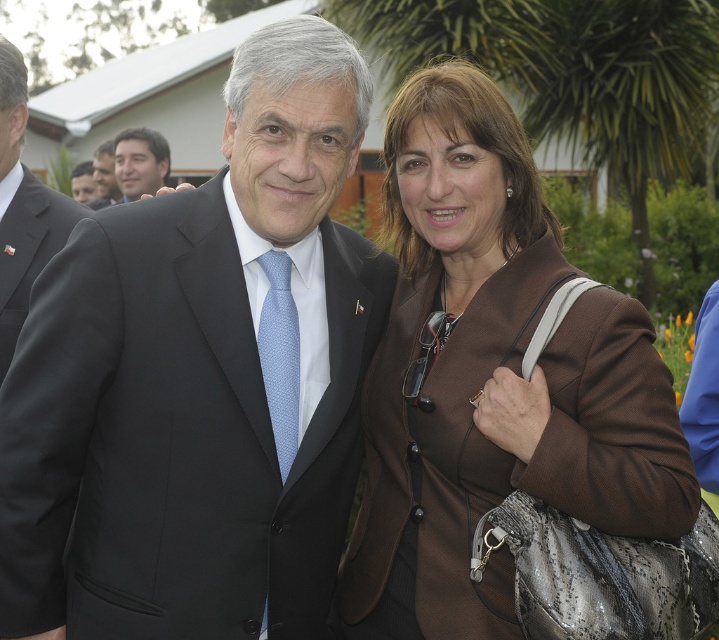
Question: Does light blue textured tie at center lie in front of matte black suit at upper left?

Choices:
 (A) yes
 (B) no

Answer: (A)

Question: Based on their relative distances, which object is nearer to the black suit at left?

Choices:
 (A) light blue textured tie at center
 (B) matte black suit at upper left
 (C) black smooth suit at center
 (D) matte black suit at center

Answer: (C)

Question: Does brown textured jacket at center come in front of black suit at left?

Choices:
 (A) yes
 (B) no

Answer: (A)

Question: Which point appears farthest from the camera in this image?

Choices:
 (A) (114, 144)
 (B) (109, 196)
 (C) (14, 301)
 (D) (100, 413)

Answer: (B)

Question: Which point is closer to the camera?

Choices:
 (A) brown textured jacket at center
 (B) black smooth suit at center
 (C) matte black suit at upper left
 (D) matte black suit at center

Answer: (B)

Question: Can you confirm if black smooth suit at center is positioned to the right of black suit at left?

Choices:
 (A) yes
 (B) no

Answer: (A)